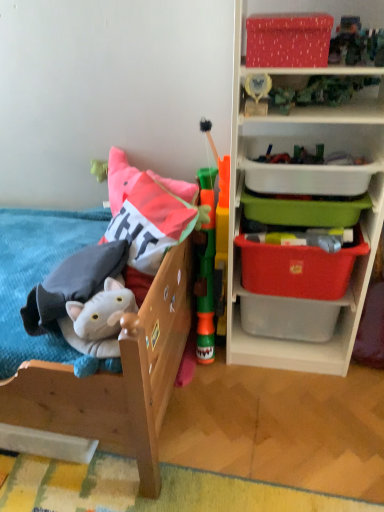
Question: Looking at their shapes, would you say wooden bed at left is wider or thinner than red plastic storage box at right, which is counted as the second storage box, starting from the bottom?

Choices:
 (A) thin
 (B) wide

Answer: (B)

Question: Would you say wooden bed at left is to the left or to the right of red plastic storage box at right, which is counted as the second storage box, starting from the bottom, in the picture?

Choices:
 (A) right
 (B) left

Answer: (B)

Question: Which object is positioned closest to the white plastic container at upper right, which ranks as the 2th storage box in top-to-bottom order?

Choices:
 (A) matte red fabric storage box at upper right, positioned as the fifth storage box in bottom-to-top order
 (B) green plastic container at upper right, which ranks as the third storage box in bottom-to-top order
 (C) soft plush cat at left, the first toy in the left-to-right sequence
 (D) wooden bed at left
 (E) red plastic storage box at right, which is the 1th storage box in bottom-to-top order

Answer: (B)

Question: Estimate the real-world distances between objects in this image. Which object is closer to the green plastic tower at center, which ranks as the 2th toy in left-to-right order?

Choices:
 (A) plastic storage bins at right
 (B) red plastic storage box at right, acting as the fifth storage box starting from the top
 (C) red plastic storage box at right, which is counted as the second storage box, starting from the bottom
 (D) matte red fabric storage box at upper right, the first storage box viewed from the top
 (E) white plastic container at upper right, which ranks as the 2th storage box in top-to-bottom order

Answer: (A)